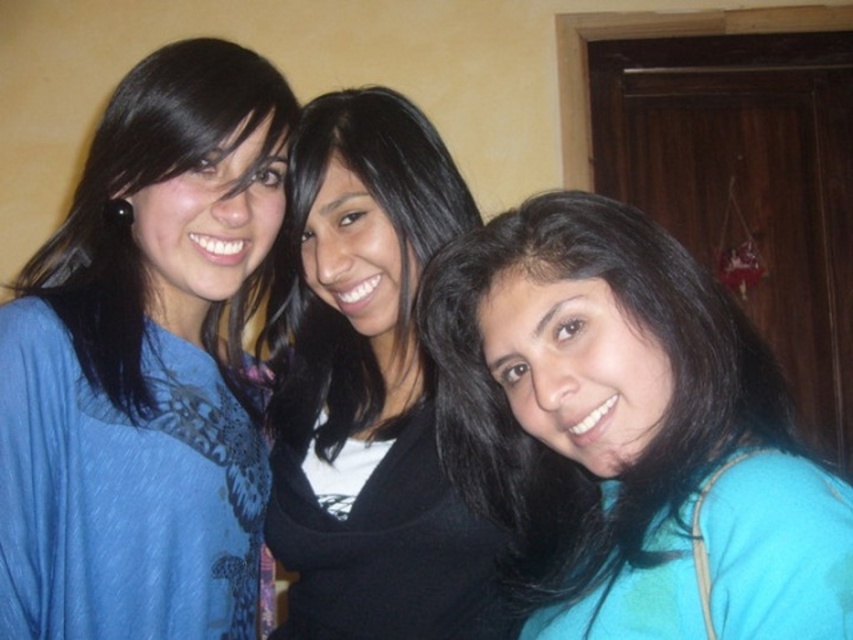
Question: Is matte blue blouse at left further to camera compared to teal fabric at center?

Choices:
 (A) no
 (B) yes

Answer: (B)

Question: Among these objects, which one is farthest from the camera?

Choices:
 (A) matte blue blouse at left
 (B) teal fabric at center

Answer: (A)

Question: Does matte blue blouse at left have a smaller size compared to teal fabric at center?

Choices:
 (A) no
 (B) yes

Answer: (A)

Question: Where is matte blue blouse at left located in relation to teal fabric at center in the image?

Choices:
 (A) left
 (B) right

Answer: (A)

Question: Which point is closer to the camera?

Choices:
 (A) (788, 518)
 (B) (192, 481)

Answer: (A)